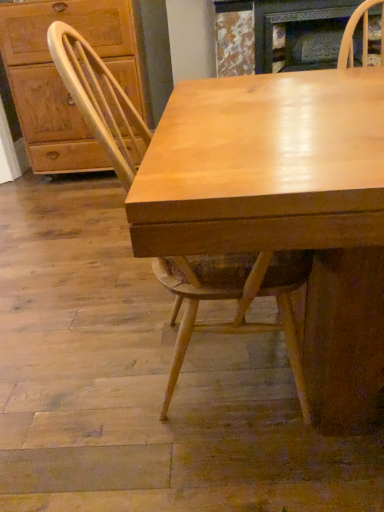
Question: Is marble textured fireplace at upper center shorter than light wood chair at center?

Choices:
 (A) yes
 (B) no

Answer: (A)

Question: Can you confirm if marble textured fireplace at upper center is taller than light wood chair at center?

Choices:
 (A) no
 (B) yes

Answer: (A)

Question: From a real-world perspective, is marble textured fireplace at upper center on top of light wood chair at center?

Choices:
 (A) no
 (B) yes

Answer: (B)

Question: Can you confirm if marble textured fireplace at upper center is wider than light wood chair at center?

Choices:
 (A) no
 (B) yes

Answer: (A)

Question: Is marble textured fireplace at upper center in contact with light wood chair at center?

Choices:
 (A) no
 (B) yes

Answer: (A)

Question: Could light wood chair at center be considered to be inside marble textured fireplace at upper center?

Choices:
 (A) yes
 (B) no

Answer: (B)

Question: Considering the relative sizes of light wood chair at center and matte wood cabinet at left in the image provided, is light wood chair at center smaller than matte wood cabinet at left?

Choices:
 (A) no
 (B) yes

Answer: (B)

Question: Could you tell me if light wood chair at center is facing matte wood cabinet at left?

Choices:
 (A) no
 (B) yes

Answer: (A)

Question: Considering the relative sizes of light wood chair at center and matte wood cabinet at left in the image provided, is light wood chair at center bigger than matte wood cabinet at left?

Choices:
 (A) yes
 (B) no

Answer: (B)

Question: From the image's perspective, would you say light wood chair at center is positioned over matte wood cabinet at left?

Choices:
 (A) no
 (B) yes

Answer: (A)

Question: Is light wood chair at center positioned before matte wood cabinet at left?

Choices:
 (A) yes
 (B) no

Answer: (A)

Question: Considering the relative sizes of light wood chair at center and matte wood cabinet at left in the image provided, is light wood chair at center wider than matte wood cabinet at left?

Choices:
 (A) no
 (B) yes

Answer: (B)

Question: Is the depth of matte wood cabinet at left less than that of light wood chair at center?

Choices:
 (A) no
 (B) yes

Answer: (A)